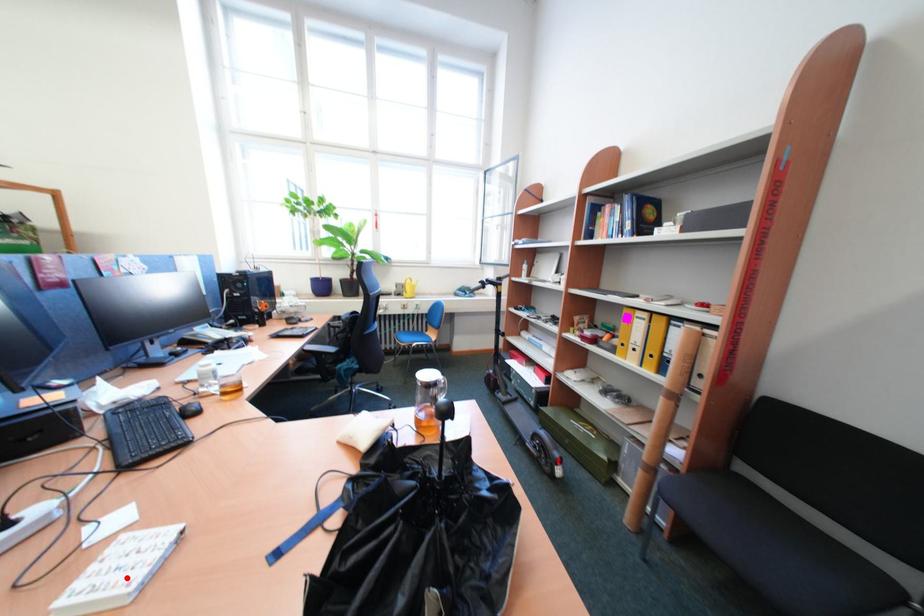
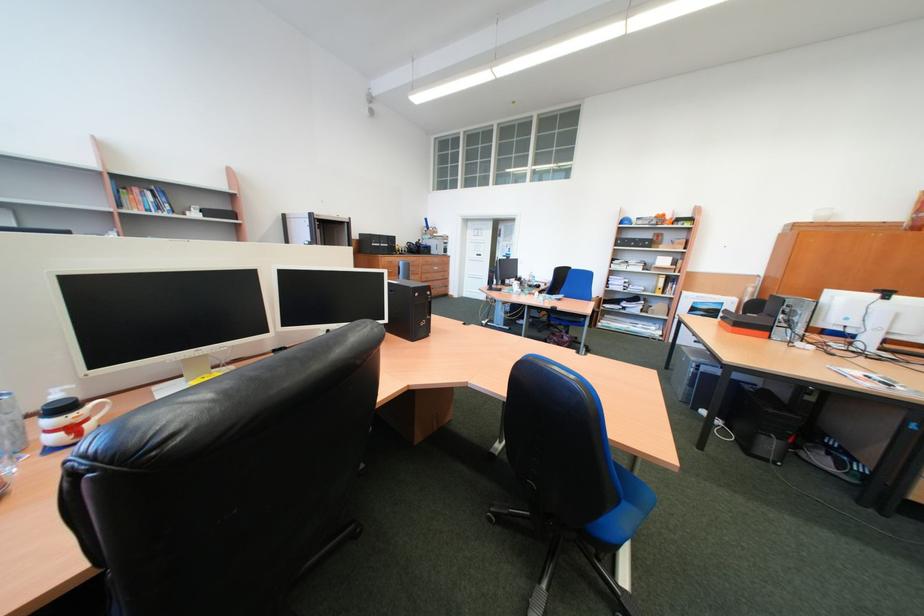
Question: I am providing you with two images of the same scene from different viewpoints. A red point is marked on the first image. At the location where the point appears in image 1, is it still visible in image 2?

Choices:
 (A) Yes
 (B) No

Answer: (B)